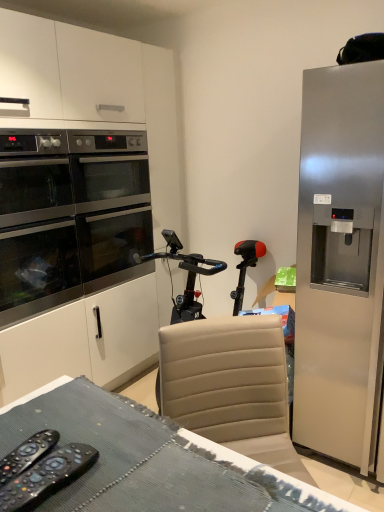
Where is `free space to the back side of black plastic remote controls at lower left, which ranks as the 2th remote control in left-to-right order`? free space to the back side of black plastic remote controls at lower left, which ranks as the 2th remote control in left-to-right order is located at coordinates (68, 421).